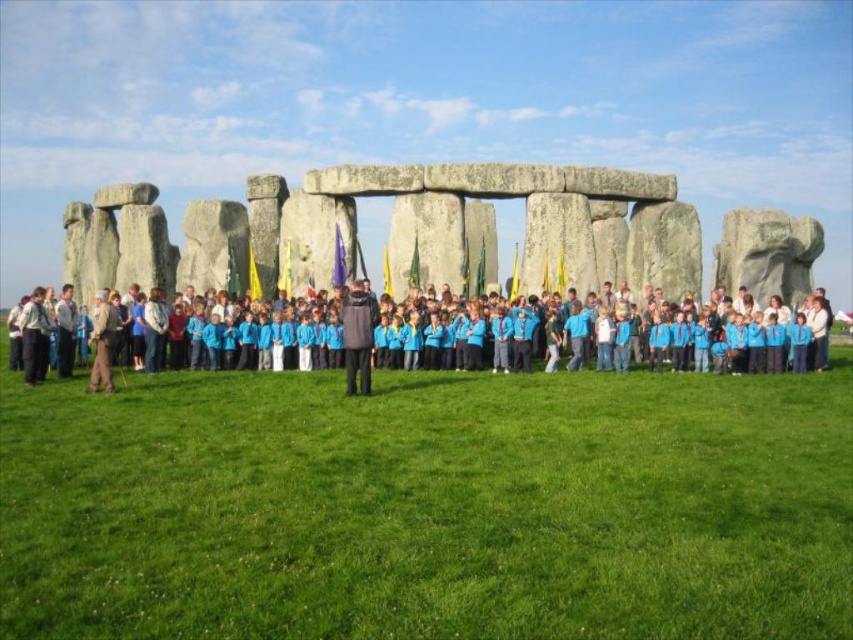
You are a photographer at Stonehenge and want to capture both the dark gray jacket at center and the blue fabric flag at center in a single photo. Which object should you focus on first to ensure both are in frame?

You should focus on the blue fabric flag at center first since the dark gray jacket at center is located below it, ensuring both will be captured in the frame.